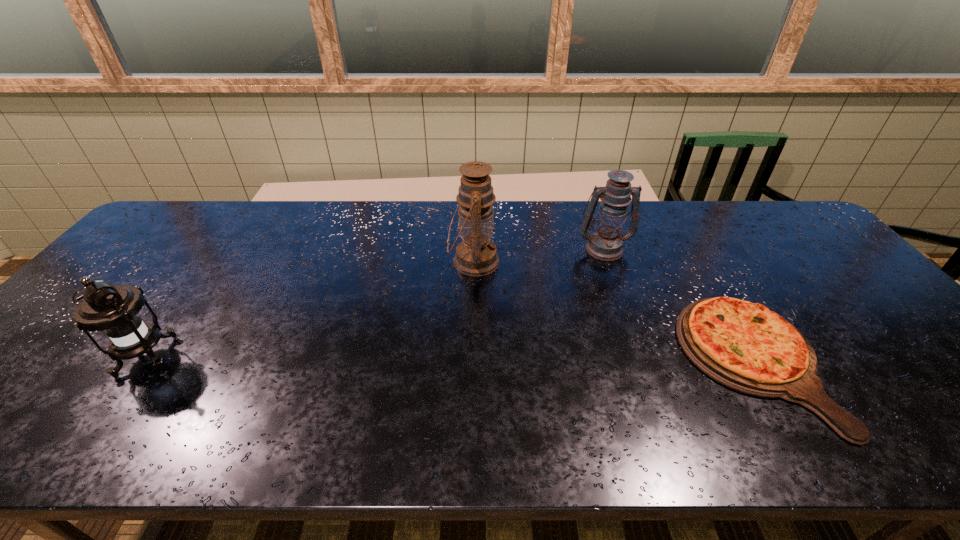
I want to click on the tallest object, so click(476, 255).

I want to click on the third object from right to left, so click(x=476, y=255).

In order to click on the farther lantern in this screenshot , I will do `click(605, 243)`.

Locate an element on the screen. The image size is (960, 540). the second object from right to left is located at coordinates (605, 243).

Locate an element on the screen. The image size is (960, 540). the left lantern is located at coordinates (114, 310).

Find the location of a particular element. the leftmost object is located at coordinates (114, 310).

Image resolution: width=960 pixels, height=540 pixels. Identify the location of the shortest object. (744, 346).

This screenshot has height=540, width=960. I want to click on pizza, so click(x=744, y=346).

Find the location of a particular element. The height and width of the screenshot is (540, 960). vacant space located 0.300m on the left of the oil lamp is located at coordinates (348, 262).

This screenshot has height=540, width=960. I want to click on free point located on the front-facing side of the second object from right to left, so click(626, 310).